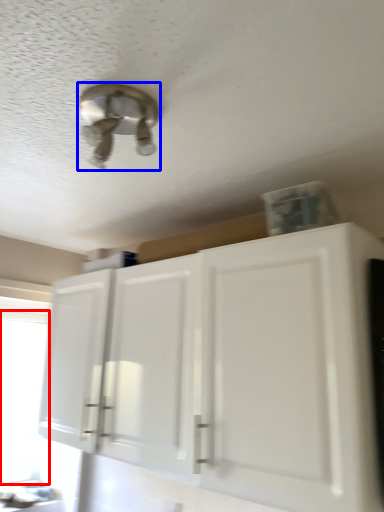
Question: Among these objects, which one is nearest to the camera, window screen (highlighted by a red box) or light fixture (highlighted by a blue box)?

Choices:
 (A) window screen
 (B) light fixture

Answer: (B)